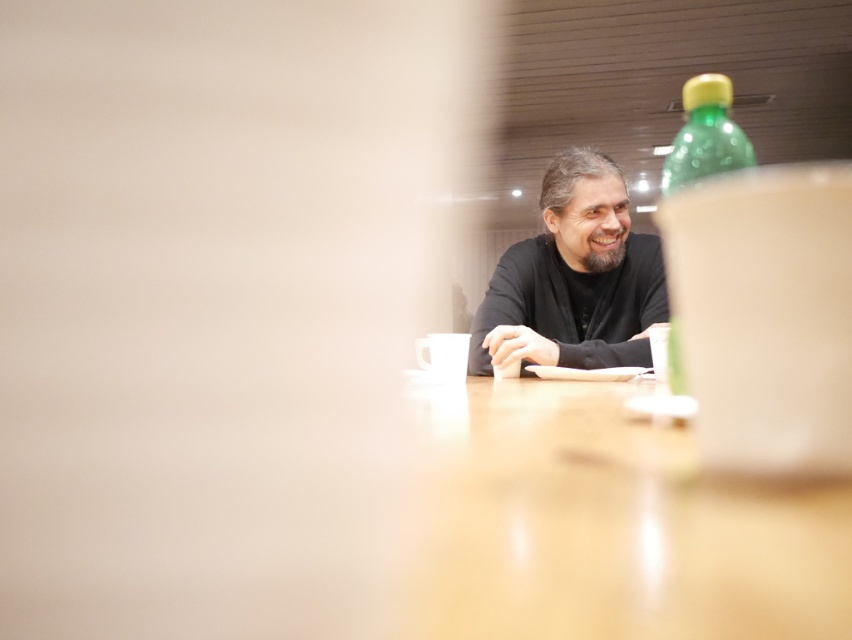
Question: Does black matte shirt at center have a smaller size compared to green plastic bottle at upper right?

Choices:
 (A) yes
 (B) no

Answer: (B)

Question: Is black matte shirt at center wider than green plastic bottle at upper right?

Choices:
 (A) yes
 (B) no

Answer: (A)

Question: Which object is positioned closest to the black matte shirt at center?

Choices:
 (A) green plastic bottle at upper right
 (B) green translucent bottle at upper right
 (C) light brown polished wood table at center

Answer: (C)

Question: Does light brown polished wood table at center have a larger size compared to black matte shirt at center?

Choices:
 (A) yes
 (B) no

Answer: (B)

Question: Estimate the real-world distances between objects in this image. Which object is farther from the green translucent bottle at upper right?

Choices:
 (A) black matte shirt at center
 (B) green plastic bottle at upper right

Answer: (A)

Question: Which of the following is the farthest from the observer?

Choices:
 (A) green translucent bottle at upper right
 (B) green plastic bottle at upper right
 (C) black matte shirt at center

Answer: (C)